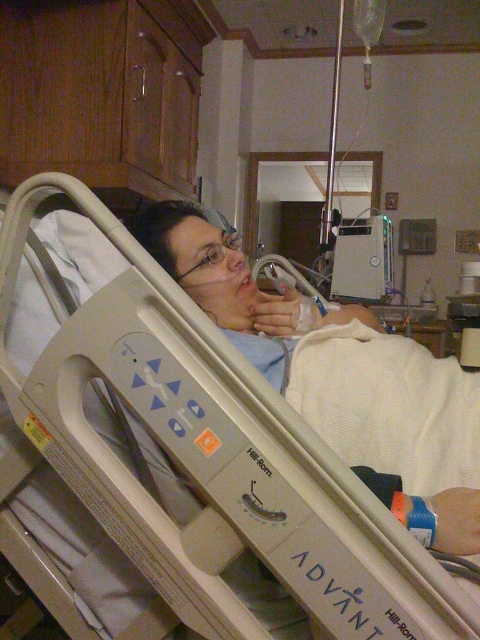
Is beige plastic bed at center bigger than metallic silver air purifier at upper center?

Indeed, beige plastic bed at center has a larger size compared to metallic silver air purifier at upper center.

Looking at this image, does beige plastic bed at center have a smaller size compared to metallic silver air purifier at upper center?

Actually, beige plastic bed at center might be larger than metallic silver air purifier at upper center.

Does point (271, 486) come farther from viewer compared to point (371, 268)?

No, it is not.

Find the location of a particular element. This screenshot has width=480, height=640. beige plastic bed at center is located at coordinates (231, 442).

Is metallic silver air purifier at upper center to the right of clear plastic glasses at center from the viewer's perspective?

Correct, you'll find metallic silver air purifier at upper center to the right of clear plastic glasses at center.

Identify the location of metallic silver air purifier at upper center. This screenshot has width=480, height=640. (362, 260).

Can you confirm if beige plastic bed at center is bigger than clear plastic glasses at center?

Indeed, beige plastic bed at center has a larger size compared to clear plastic glasses at center.

Between beige plastic bed at center and clear plastic glasses at center, which one is positioned higher?

clear plastic glasses at center

Is point (21, 316) farther from camera compared to point (226, 230)?

No.

The image size is (480, 640). In order to click on beige plastic bed at center in this screenshot , I will do `click(231, 442)`.